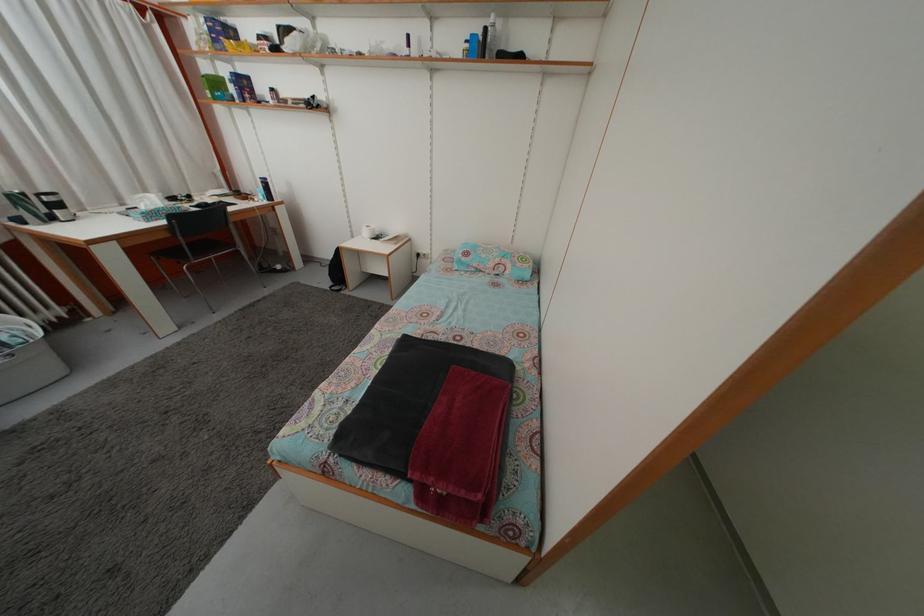
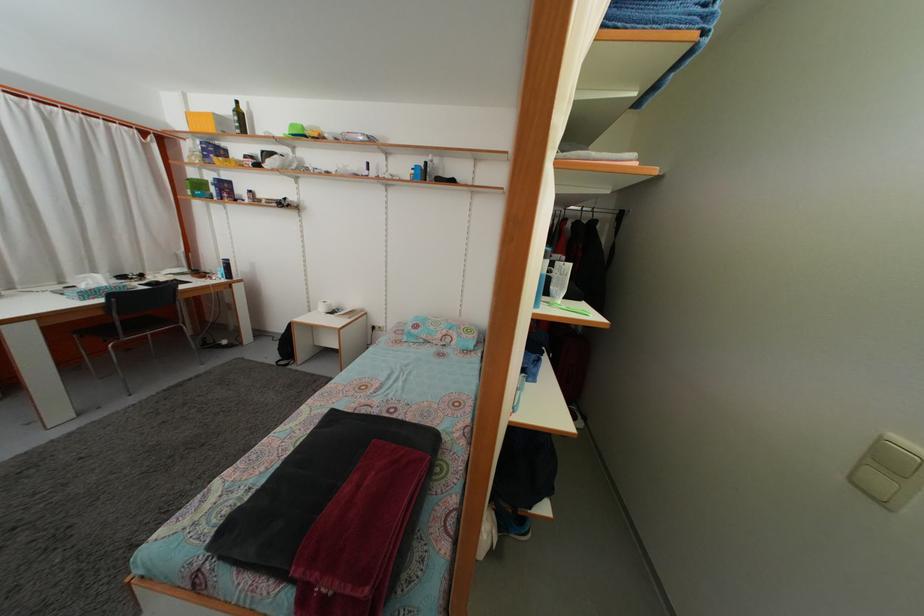
Find the pixel in the second image that matches point 266,199 in the first image.

(226, 278)